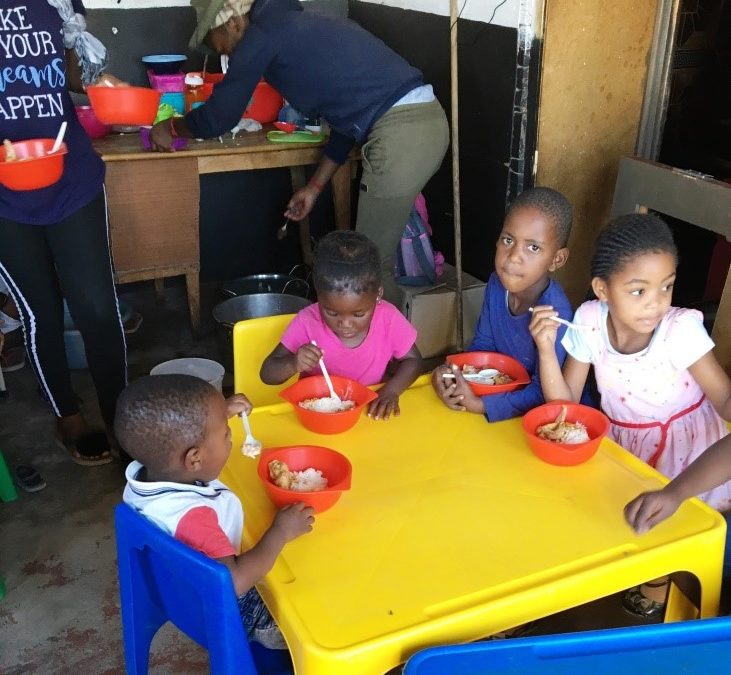
This screenshot has width=731, height=675. In order to click on spoon in this screenshot , I will do `click(564, 335)`.